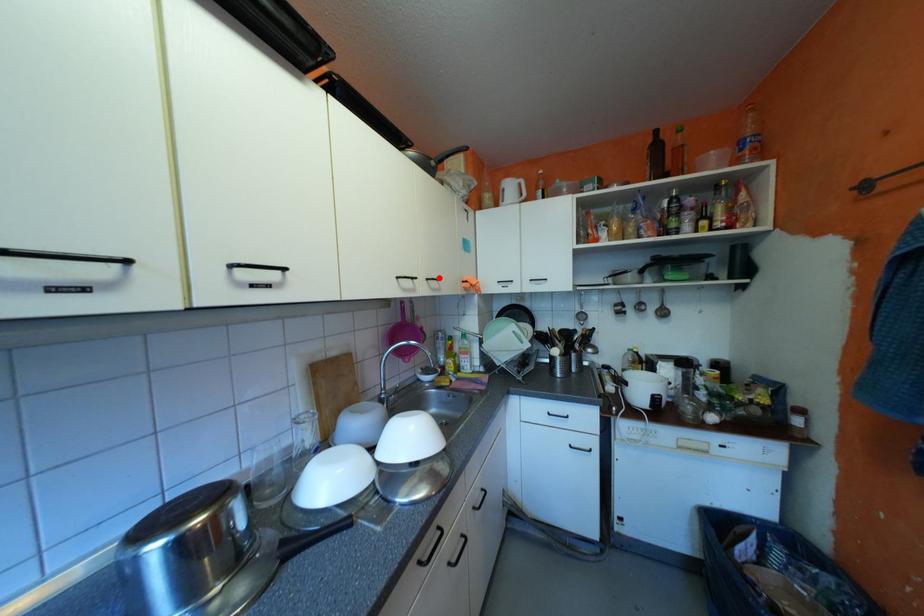
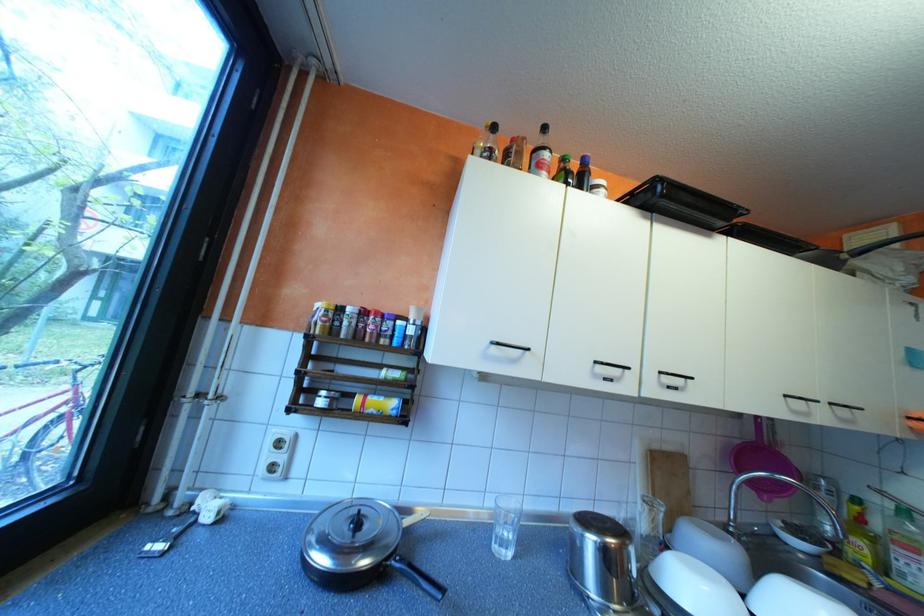
The point at the highlighted location is marked in the first image. Where is the corresponding point in the second image?

(843, 403)